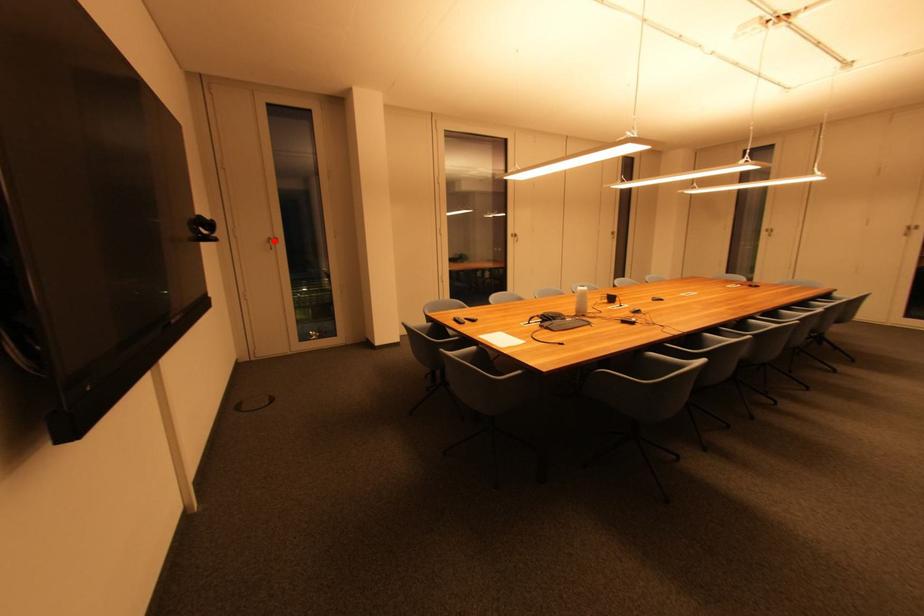
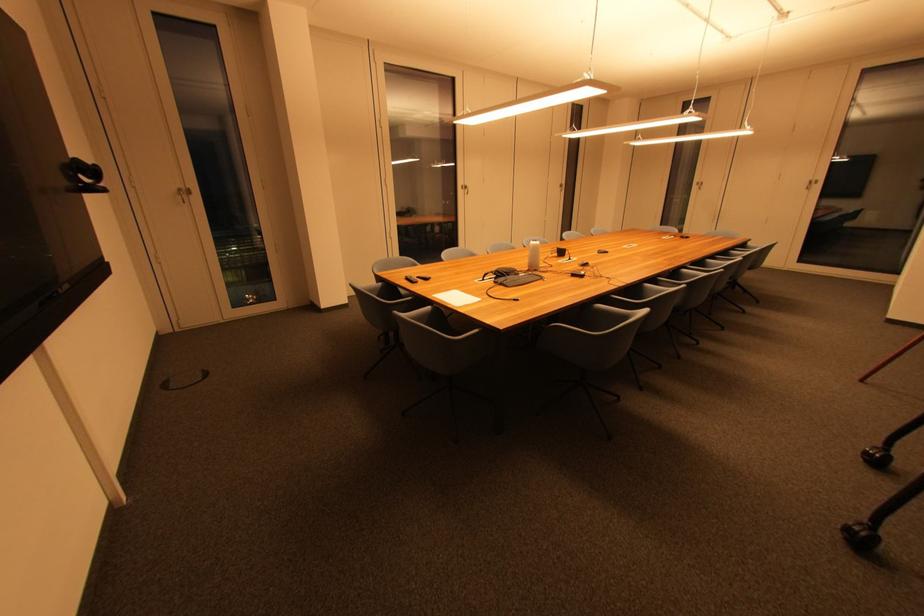
Locate, in the second image, the point that corresponds to the highlighted location in the first image.

(185, 192)